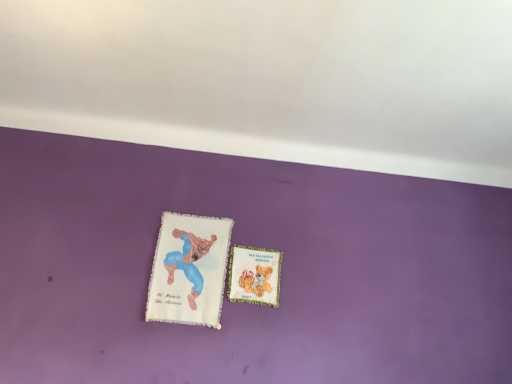
Question: Does pastel green fabric bookmark at center, which is counted as the 2th paperback book, starting from the left, have a greater width compared to white fabric book at center, the 1th paperback book in the left-to-right sequence?

Choices:
 (A) yes
 (B) no

Answer: (B)

Question: Considering the relative sizes of pastel green fabric bookmark at center, which is counted as the 2th paperback book, starting from the left, and white fabric book at center, the second paperback book viewed from the right, in the image provided, is pastel green fabric bookmark at center, which is counted as the 2th paperback book, starting from the left, thinner than white fabric book at center, the second paperback book viewed from the right,?

Choices:
 (A) yes
 (B) no

Answer: (A)

Question: Considering the relative positions of pastel green fabric bookmark at center, marked as the 1th paperback book in a right-to-left arrangement, and white fabric book at center, the 1th paperback book in the left-to-right sequence, in the image provided, is pastel green fabric bookmark at center, marked as the 1th paperback book in a right-to-left arrangement, in front of white fabric book at center, the 1th paperback book in the left-to-right sequence,?

Choices:
 (A) no
 (B) yes

Answer: (A)

Question: Is pastel green fabric bookmark at center, which is counted as the 2th paperback book, starting from the left, to the right of white fabric book at center, the second paperback book viewed from the right, from the viewer's perspective?

Choices:
 (A) yes
 (B) no

Answer: (A)

Question: Could you tell me if pastel green fabric bookmark at center, marked as the 1th paperback book in a right-to-left arrangement, is facing white fabric book at center, the 1th paperback book in the left-to-right sequence?

Choices:
 (A) yes
 (B) no

Answer: (B)

Question: Would you say white fabric book at center, the 1th paperback book in the left-to-right sequence, is part of pastel green fabric bookmark at center, which is counted as the 2th paperback book, starting from the left,'s contents?

Choices:
 (A) no
 (B) yes

Answer: (A)

Question: Would you say white fabric book at center, the 1th paperback book in the left-to-right sequence, is a long distance from pastel green fabric bookmark at center, which is counted as the 2th paperback book, starting from the left?

Choices:
 (A) no
 (B) yes

Answer: (A)

Question: Is white fabric book at center, the 1th paperback book in the left-to-right sequence, with pastel green fabric bookmark at center, which is counted as the 2th paperback book, starting from the left?

Choices:
 (A) yes
 (B) no

Answer: (B)

Question: Considering the relative sizes of white fabric book at center, the 1th paperback book in the left-to-right sequence, and pastel green fabric bookmark at center, marked as the 1th paperback book in a right-to-left arrangement, in the image provided, is white fabric book at center, the 1th paperback book in the left-to-right sequence, thinner than pastel green fabric bookmark at center, marked as the 1th paperback book in a right-to-left arrangement,?

Choices:
 (A) yes
 (B) no

Answer: (B)

Question: Considering the relative sizes of white fabric book at center, the 1th paperback book in the left-to-right sequence, and pastel green fabric bookmark at center, marked as the 1th paperback book in a right-to-left arrangement, in the image provided, is white fabric book at center, the 1th paperback book in the left-to-right sequence, shorter than pastel green fabric bookmark at center, marked as the 1th paperback book in a right-to-left arrangement,?

Choices:
 (A) no
 (B) yes

Answer: (A)

Question: From a real-world perspective, is white fabric book at center, the 1th paperback book in the left-to-right sequence, physically above pastel green fabric bookmark at center, which is counted as the 2th paperback book, starting from the left?

Choices:
 (A) no
 (B) yes

Answer: (A)

Question: From the image's perspective, is white fabric book at center, the 1th paperback book in the left-to-right sequence, under pastel green fabric bookmark at center, marked as the 1th paperback book in a right-to-left arrangement?

Choices:
 (A) no
 (B) yes

Answer: (A)

Question: From a real-world perspective, is white fabric book at center, the 1th paperback book in the left-to-right sequence, positioned above or below pastel green fabric bookmark at center, which is counted as the 2th paperback book, starting from the left?

Choices:
 (A) above
 (B) below

Answer: (B)